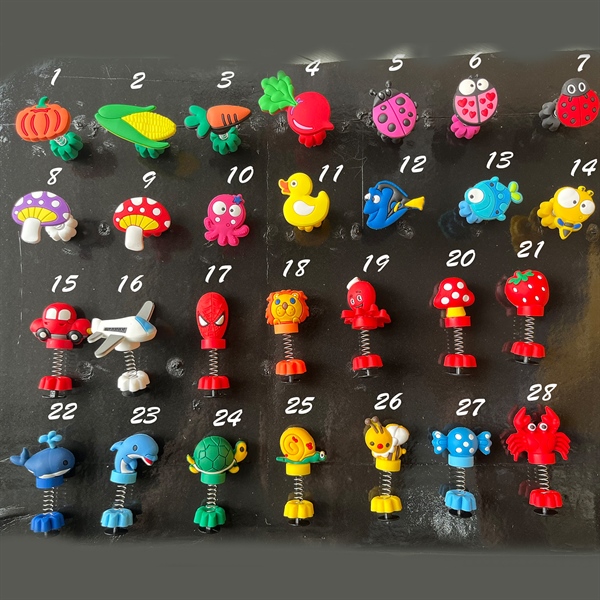
Image resolution: width=600 pixels, height=600 pixels. I want to click on seventh column of toys, so click(x=571, y=100), click(x=576, y=202), click(x=530, y=289), click(x=541, y=447).